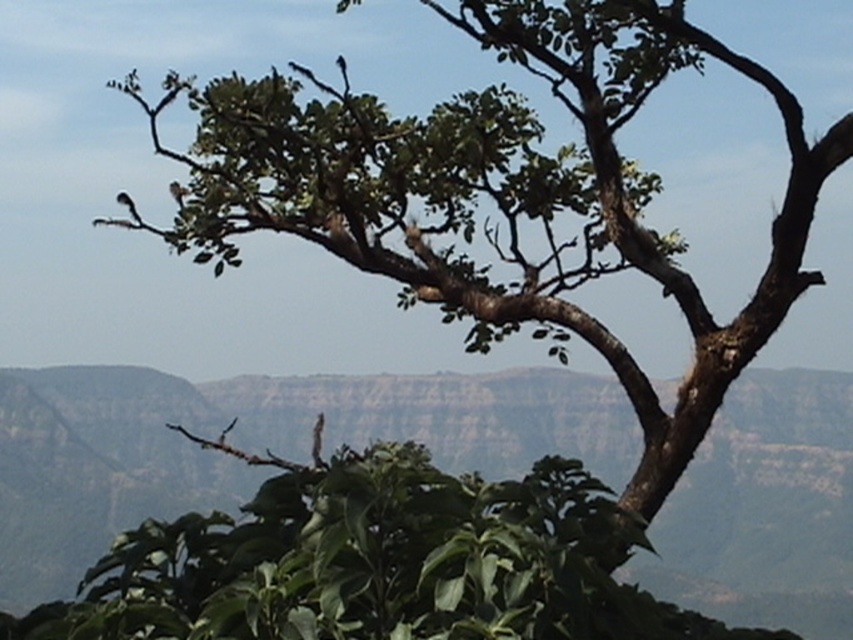
Question: Which point is farther to the camera?

Choices:
 (A) silvery metallic bird at upper left
 (B) green leafy tree at center

Answer: (B)

Question: From the image, what is the correct spatial relationship of green leafy tree at center in relation to white feathered bird at upper left?

Choices:
 (A) left
 (B) right

Answer: (B)

Question: Which point is closer to the camera?

Choices:
 (A) (180, 456)
 (B) (169, 186)
 (C) (131, 212)

Answer: (C)

Question: Considering the real-world distances, which object is closest to the silvery metallic bird at upper left?

Choices:
 (A) green leafy tree at center
 (B) white feathered bird at upper left

Answer: (B)

Question: Does green leafy tree at center appear over silvery metallic bird at upper left?

Choices:
 (A) yes
 (B) no

Answer: (B)

Question: Is the position of green leafy tree at center more distant than that of white feathered bird at upper left?

Choices:
 (A) no
 (B) yes

Answer: (B)